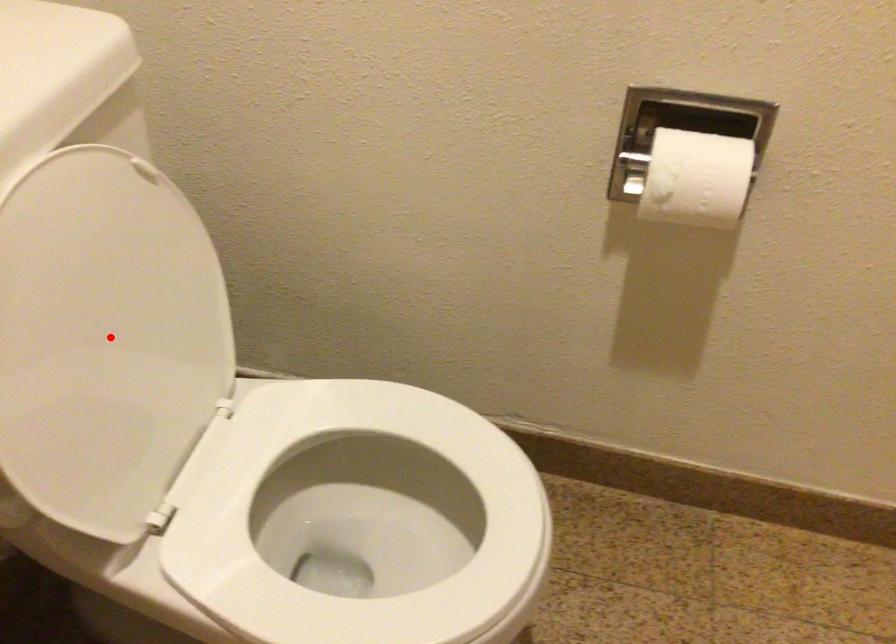
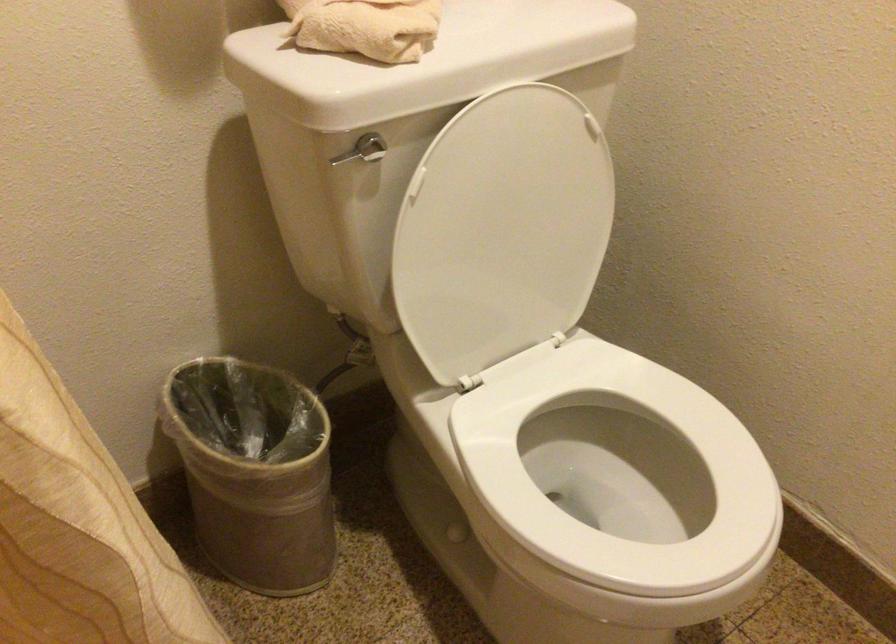
Locate, in the second image, the point that corresponds to the highlighted location in the first image.

(502, 230)